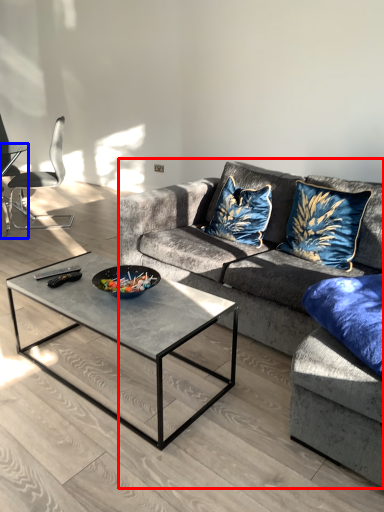
Question: Among these objects, which one is farthest to the camera, studio couch (highlighted by a red box) or coffee table (highlighted by a blue box)?

Choices:
 (A) studio couch
 (B) coffee table

Answer: (B)